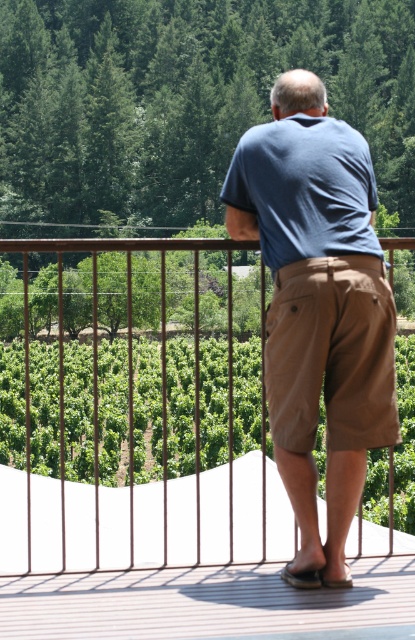
Does brown wood balcony at center appear on the right side of brown textured deck at center?

No, brown wood balcony at center is not to the right of brown textured deck at center.

Is point (56, 444) in front of point (356, 582)?

No, it is behind (356, 582).

At what (x,y) coordinates should I click in order to perform the action: click on brown wood balcony at center. Please return your answer as a coordinate pair (x, y). This screenshot has width=415, height=640. Looking at the image, I should click on (136, 412).

Which is more to the left, blue cotton shirt at center or brown textured deck at center?

brown textured deck at center is more to the left.

Does point (268, 163) come behind point (341, 600)?

Yes.

Identify the location of blue cotton shirt at center. Image resolution: width=415 pixels, height=640 pixels. (317, 307).

Between brown wood balcony at center and blue cotton shirt at center, which one is positioned higher?

blue cotton shirt at center is higher up.

Can you confirm if brown wood balcony at center is shorter than blue cotton shirt at center?

No, brown wood balcony at center is not shorter than blue cotton shirt at center.

Is point (154, 486) closer to camera compared to point (339, 214)?

No.

Where is `brown wood balcony at center`? Image resolution: width=415 pixels, height=640 pixels. brown wood balcony at center is located at coordinates (136, 412).